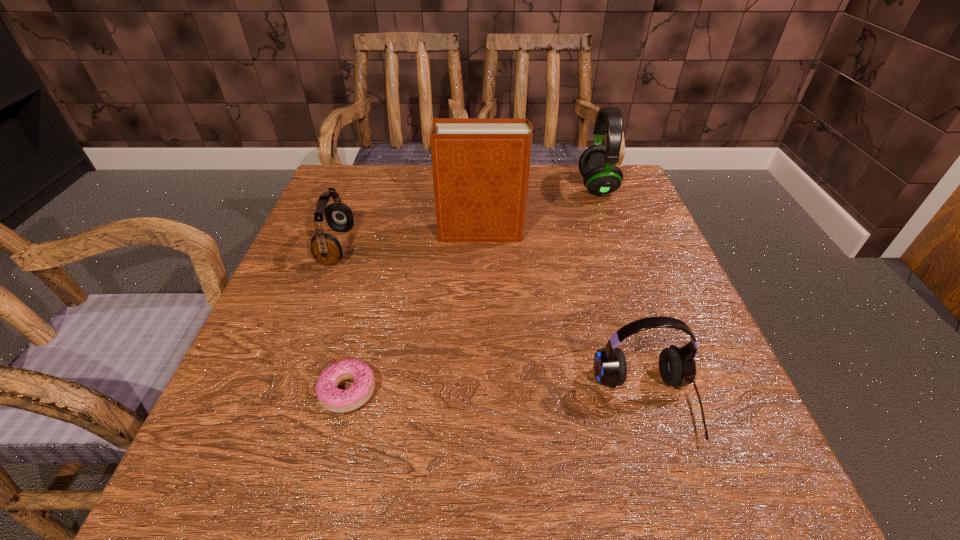
The width and height of the screenshot is (960, 540). I want to click on vacant area situated on the open cover of the tallest object, so click(308, 232).

Where is `free space located on the open cover of the tallest object`? free space located on the open cover of the tallest object is located at coordinates pyautogui.click(x=308, y=232).

Where is `vacant area located 0.290m on the ear cups of the fourth shortest object`? vacant area located 0.290m on the ear cups of the fourth shortest object is located at coordinates (464, 186).

Identify the location of vacant area located on the ear cups of the fourth shortest object. (428, 186).

What are the coordinates of `vacant position located 0.380m on the ear cups of the fourth shortest object` in the screenshot? It's located at (428, 186).

At what (x,y) coordinates should I click in order to perform the action: click on vacant region located on the ear cushions of the nearest headset. Please return your answer as a coordinate pair (x, y). The width and height of the screenshot is (960, 540). Looking at the image, I should click on (671, 483).

This screenshot has height=540, width=960. Identify the location of vacant point located on the ear cups of the leftmost headset. (394, 246).

This screenshot has height=540, width=960. I want to click on free region located 0.210m on the right of the shortest object, so click(512, 392).

This screenshot has width=960, height=540. Find the location of `object at the far edge`. object at the far edge is located at coordinates (597, 164).

Locate an element on the screen. The width and height of the screenshot is (960, 540). object present at the near edge is located at coordinates (677, 367).